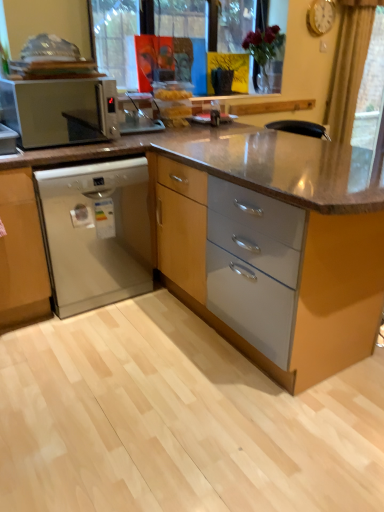
In order to face beige fabric curtain at upper right, should I rotate leftwards or rightwards?

You should rotate right by 20.934 degrees.

What are the coordinates of `white plastic microwave at left` in the screenshot? It's located at (60, 111).

What's the angular difference between beige fabric curtain at upper right and matte wood cabinet at center's facing directions?

beige fabric curtain at upper right and matte wood cabinet at center are facing 91.5 degrees away from each other.

Is beige fabric curtain at upper right thinner than matte wood cabinet at center?

Correct, the width of beige fabric curtain at upper right is less than that of matte wood cabinet at center.

Do you think beige fabric curtain at upper right is within matte wood cabinet at center, or outside of it?

beige fabric curtain at upper right is not enclosed by matte wood cabinet at center.

Which of these two, beige fabric curtain at upper right or matte wood cabinet at center, is bigger?

matte wood cabinet at center is bigger.

Which object is thinner, satin silver dishwasher at lower left or white plastic microwave at left?

white plastic microwave at left.

From the image's perspective, is satin silver dishwasher at lower left beneath white plastic microwave at left?

Correct, satin silver dishwasher at lower left appears lower than white plastic microwave at left in the image.

From the picture: Considering the relative sizes of satin silver dishwasher at lower left and white plastic microwave at left in the image provided, is satin silver dishwasher at lower left bigger than white plastic microwave at left?

Correct, satin silver dishwasher at lower left is larger in size than white plastic microwave at left.

How distant is satin silver dishwasher at lower left from white plastic microwave at left?

6.47 feet.

From the image's perspective, is satin silver dishwasher at lower left under beige fabric curtain at upper right?

Yes.

How far apart are satin silver dishwasher at lower left and beige fabric curtain at upper right?

They are 2.30 meters apart.

Which object is positioned more to the right, satin silver dishwasher at lower left or beige fabric curtain at upper right?

Positioned to the right is beige fabric curtain at upper right.

The image size is (384, 512). I want to click on curtain that appears behind the satin silver dishwasher at lower left, so click(x=349, y=66).

Is point (36, 131) positioned in front of point (335, 124)?

No, it is behind (335, 124).

Where is `curtain above the white plastic microwave at left (from the image's perspective)`? The width and height of the screenshot is (384, 512). curtain above the white plastic microwave at left (from the image's perspective) is located at coordinates (349, 66).

Based on the photo, considering the relative sizes of white plastic microwave at left and beige fabric curtain at upper right in the image provided, is white plastic microwave at left smaller than beige fabric curtain at upper right?

Yes.

Does matte wood cabinet at center have a lesser width compared to beige fabric curtain at upper right?

Incorrect, the width of matte wood cabinet at center is not less than that of beige fabric curtain at upper right.

Which of these two, matte wood cabinet at center or beige fabric curtain at upper right, stands taller?

beige fabric curtain at upper right is taller.

Is matte wood cabinet at center positioned with its back to beige fabric curtain at upper right?

Yes, matte wood cabinet at center is positioned with its back facing beige fabric curtain at upper right.

Is matte wood cabinet at center inside or outside of beige fabric curtain at upper right?

matte wood cabinet at center is outside beige fabric curtain at upper right.

How many degrees apart are the facing directions of satin silver dishwasher at lower left and matte wood cabinet at center?

91.6 degrees.

Based on the photo, can we say satin silver dishwasher at lower left lies outside matte wood cabinet at center?

Yes, satin silver dishwasher at lower left is outside of matte wood cabinet at center.

From the image's perspective, between satin silver dishwasher at lower left and matte wood cabinet at center, which one is located above?

satin silver dishwasher at lower left is shown above in the image.

Is satin silver dishwasher at lower left bigger than matte wood cabinet at center?

No, satin silver dishwasher at lower left is not bigger than matte wood cabinet at center.

From the image's perspective, is matte wood cabinet at center located beneath satin silver dishwasher at lower left?

Yes, from the image's perspective, matte wood cabinet at center is below satin silver dishwasher at lower left.

Can you see matte wood cabinet at center touching satin silver dishwasher at lower left?

No, matte wood cabinet at center is not next to satin silver dishwasher at lower left.

Between matte wood cabinet at center and satin silver dishwasher at lower left, which one is positioned in front?

matte wood cabinet at center is more forward.

Image resolution: width=384 pixels, height=512 pixels. I want to click on cabinetry below the beige fabric curtain at upper right (from a real-world perspective), so click(x=276, y=242).

Image resolution: width=384 pixels, height=512 pixels. What are the coordinates of `home appliance located on the right of white plastic microwave at left` in the screenshot? It's located at (95, 233).

Based on their spatial positions, is white plastic microwave at left or satin silver dishwasher at lower left further from matte wood cabinet at center?

white plastic microwave at left lies further to matte wood cabinet at center than the other object.

Based on the photo, when comparing their distances from matte wood cabinet at center, does white plastic microwave at left or beige fabric curtain at upper right seem further?

Based on the image, white plastic microwave at left appears to be further to matte wood cabinet at center.

Looking at the image, which one is located closer to white plastic microwave at left, satin silver dishwasher at lower left or matte wood cabinet at center?

satin silver dishwasher at lower left lies closer to white plastic microwave at left than the other object.

Looking at the image, which one is located further to beige fabric curtain at upper right, matte wood cabinet at center or white plastic microwave at left?

white plastic microwave at left is positioned further to the anchor beige fabric curtain at upper right.

From the picture: From the image, which object appears to be farther from beige fabric curtain at upper right, satin silver dishwasher at lower left or white plastic microwave at left?

Among the two, white plastic microwave at left is located further to beige fabric curtain at upper right.

Considering their positions, is white plastic microwave at left positioned further to satin silver dishwasher at lower left than matte wood cabinet at center?

white plastic microwave at left is positioned further to the anchor satin silver dishwasher at lower left.

Estimate the real-world distances between objects in this image. Which object is closer to matte wood cabinet at center, beige fabric curtain at upper right or satin silver dishwasher at lower left?

Among the two, satin silver dishwasher at lower left is located nearer to matte wood cabinet at center.

From the image, which object appears to be farther from white plastic microwave at left, matte wood cabinet at center or satin silver dishwasher at lower left?

matte wood cabinet at center.

Where is `home appliance located between white plastic microwave at left and matte wood cabinet at center in the left-right direction`? This screenshot has width=384, height=512. home appliance located between white plastic microwave at left and matte wood cabinet at center in the left-right direction is located at coordinates (95, 233).

I want to click on cabinetry situated between satin silver dishwasher at lower left and beige fabric curtain at upper right from left to right, so click(276, 242).

At what (x,y) coordinates should I click in order to perform the action: click on cabinetry between white plastic microwave at left and beige fabric curtain at upper right in the horizontal direction. Please return your answer as a coordinate pair (x, y). Image resolution: width=384 pixels, height=512 pixels. Looking at the image, I should click on (276, 242).

Where is `home appliance situated between white plastic microwave at left and beige fabric curtain at upper right from left to right`? home appliance situated between white plastic microwave at left and beige fabric curtain at upper right from left to right is located at coordinates (95, 233).